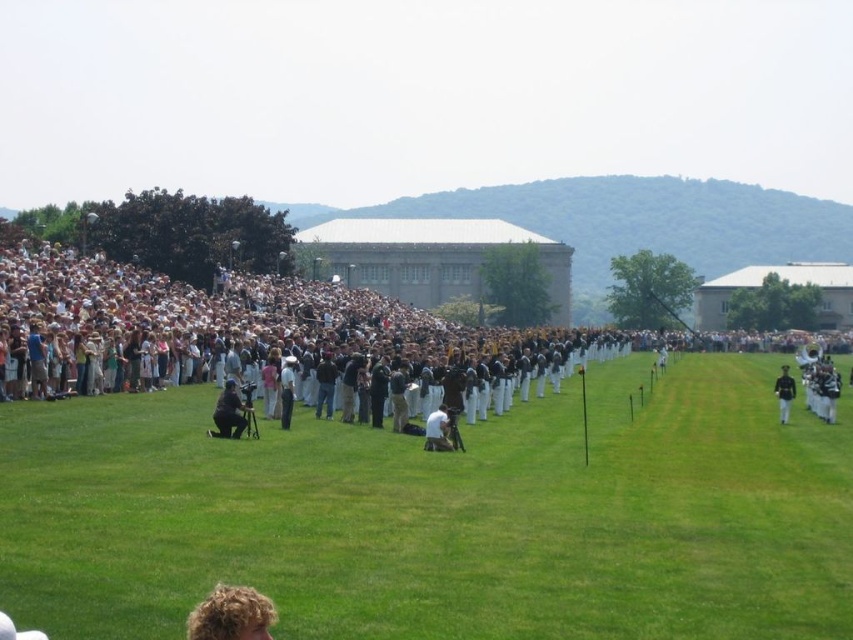
Question: Which of the following is the closest to the observer?

Choices:
 (A) white cotton shirt at center
 (B) curly blonde hair at lower left
 (C) green grass at center

Answer: (B)

Question: Is matte black camera at lower center above white cotton shirt at center?

Choices:
 (A) no
 (B) yes

Answer: (B)

Question: Among these points, which one is nearest to the camera?

Choices:
 (A) (241, 422)
 (B) (699, 563)
 (C) (445, 433)
 (D) (259, 600)

Answer: (D)

Question: Is matte black camera at lower center positioned at the back of white cotton shirt at center?

Choices:
 (A) yes
 (B) no

Answer: (A)

Question: Can you confirm if green grass at center is thinner than dark blue uniform at center?

Choices:
 (A) yes
 (B) no

Answer: (B)

Question: Which point appears farthest from the camera in this image?

Choices:
 (A) (247, 422)
 (B) (444, 417)

Answer: (A)